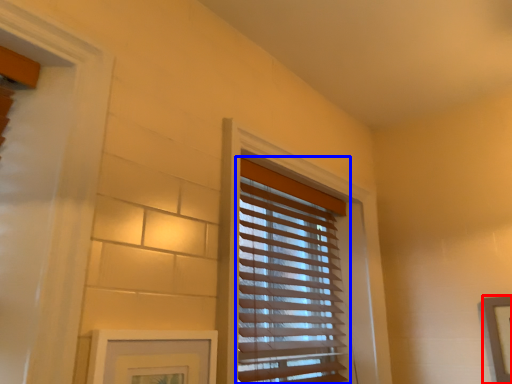
Question: Among these objects, which one is farthest to the camera, picture frame (highlighted by a red box) or window blind (highlighted by a blue box)?

Choices:
 (A) picture frame
 (B) window blind

Answer: (A)